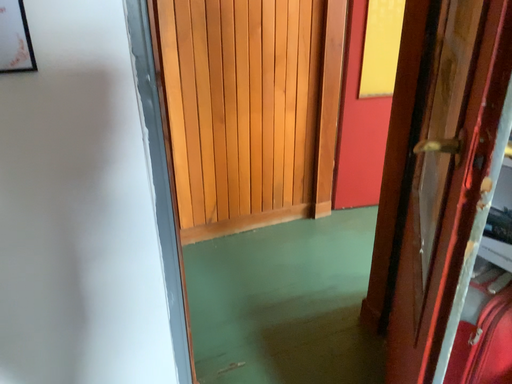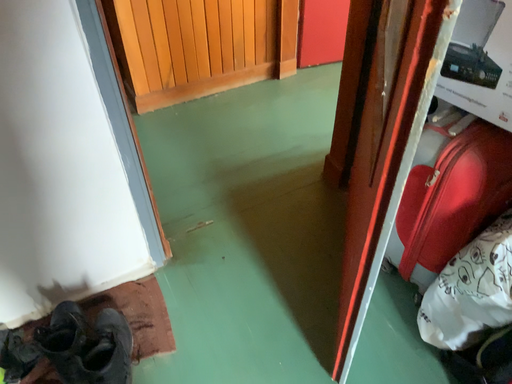
Question: Which way did the camera rotate in the video?

Choices:
 (A) rotated downward
 (B) rotated upward

Answer: (A)